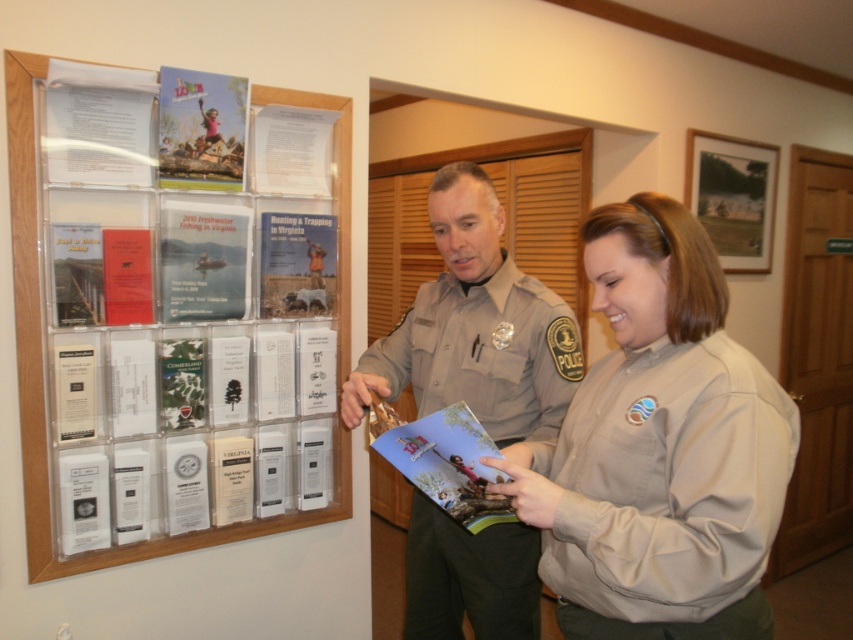
You are a visitor at a community event and want to pick up the matte plastic brochure at upper left and the beige uniform at center. Which one can you reach without moving closer to the display board?

The matte plastic brochure at upper left is closer to you than the beige uniform at center, so you can reach it without moving closer to the display board.

You are a visitor at a public information booth and need to pick up the matte plastic brochure at upper left. You are standing 1.64 meters away from it. Can you reach it without moving closer?

The matte plastic brochure at upper left is 1.64 meters away from the viewer. The average human arm length is about 0.7 meters, so you cannot reach it without moving closer.